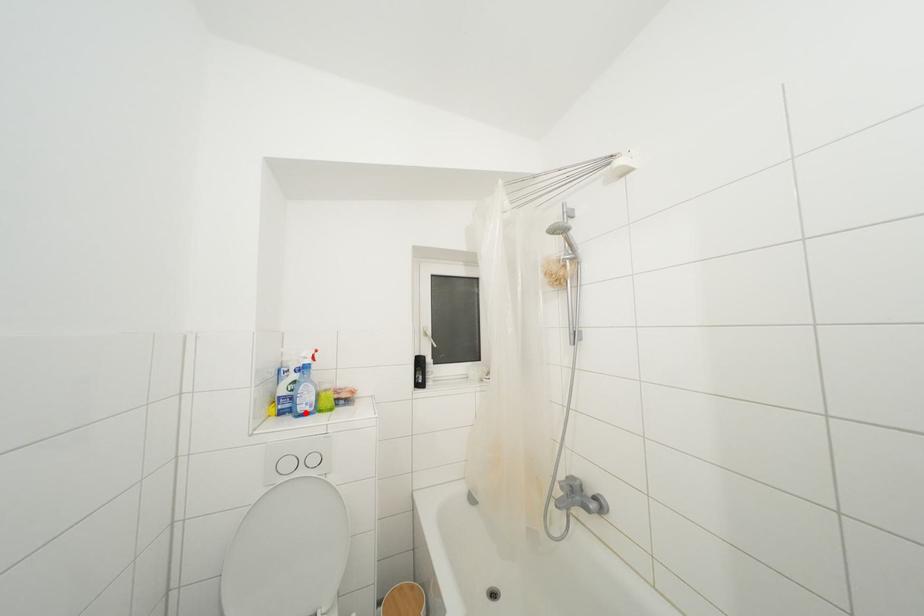
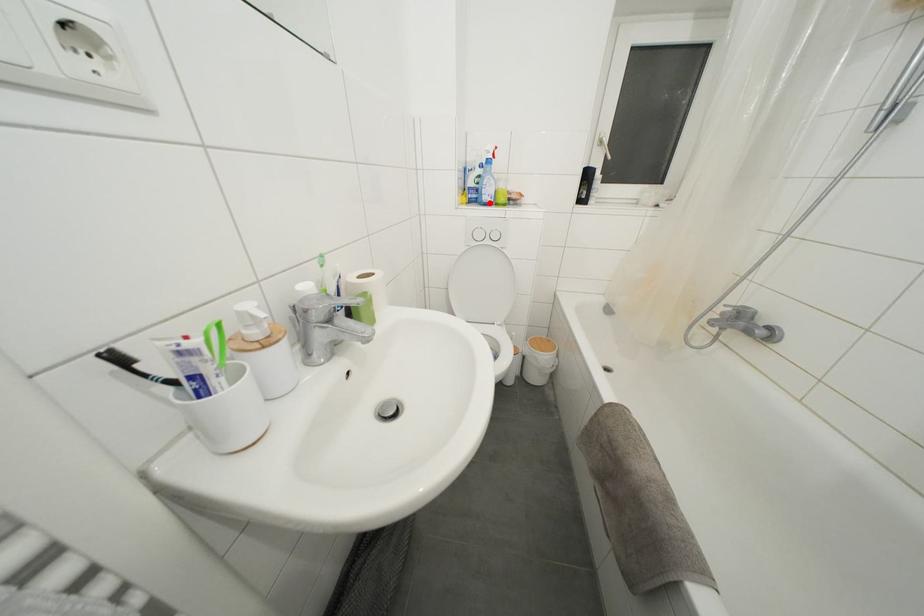
I am providing you with two images of the same scene from different viewpoints. A red point is marked on the first image and another point is marked on the second image. Are the points marked in image1 and image2 representing the same 3D position?

Yes